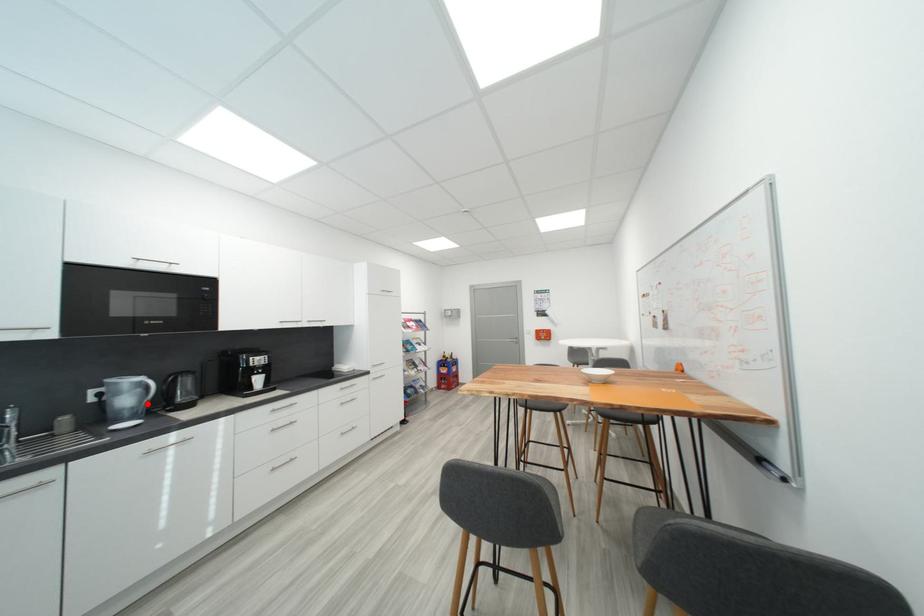
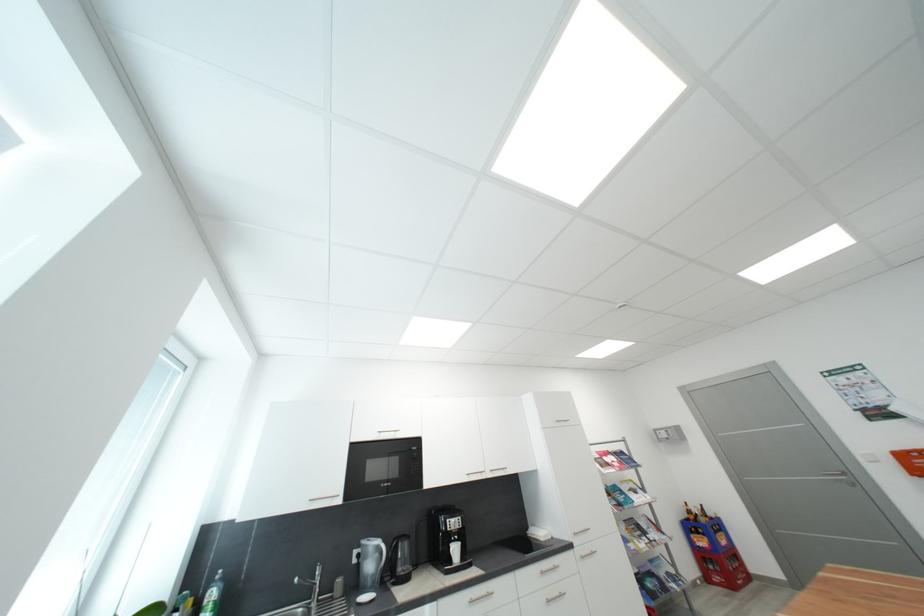
Find the pixel in the second image that matches the highlighted location in the first image.

(383, 570)